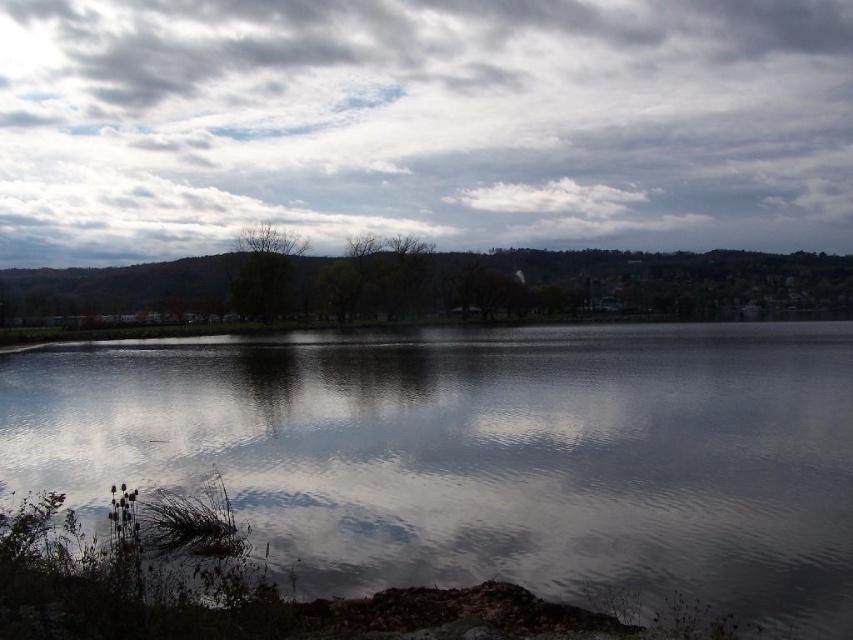
Is point (496, 182) positioned behind point (258, 534)?

Yes, it is behind point (258, 534).

The height and width of the screenshot is (640, 853). I want to click on cloudy sky at upper center, so click(x=422, y=124).

Can you confirm if cloudy sky at upper center is positioned to the left of green matte tree at center?

Incorrect, cloudy sky at upper center is not on the left side of green matte tree at center.

The image size is (853, 640). What do you see at coordinates (422, 124) in the screenshot?
I see `cloudy sky at upper center` at bounding box center [422, 124].

At what (x,y) coordinates should I click in order to perform the action: click on cloudy sky at upper center. Please return your answer as a coordinate pair (x, y). Looking at the image, I should click on point(422,124).

Can you confirm if glossy reflective water at center is shorter than green matte tree at center?

Indeed, glossy reflective water at center has a lesser height compared to green matte tree at center.

Who is higher up, glossy reflective water at center or green matte tree at center?

green matte tree at center

This screenshot has height=640, width=853. Find the location of `glossy reflective water at center`. glossy reflective water at center is located at coordinates (480, 456).

This screenshot has height=640, width=853. Identify the location of glossy reflective water at center. (480, 456).